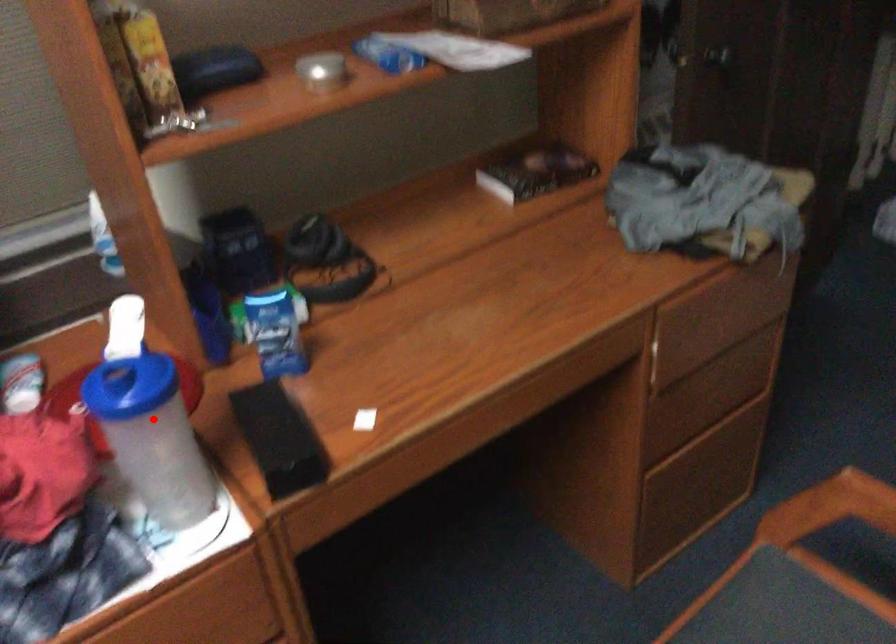
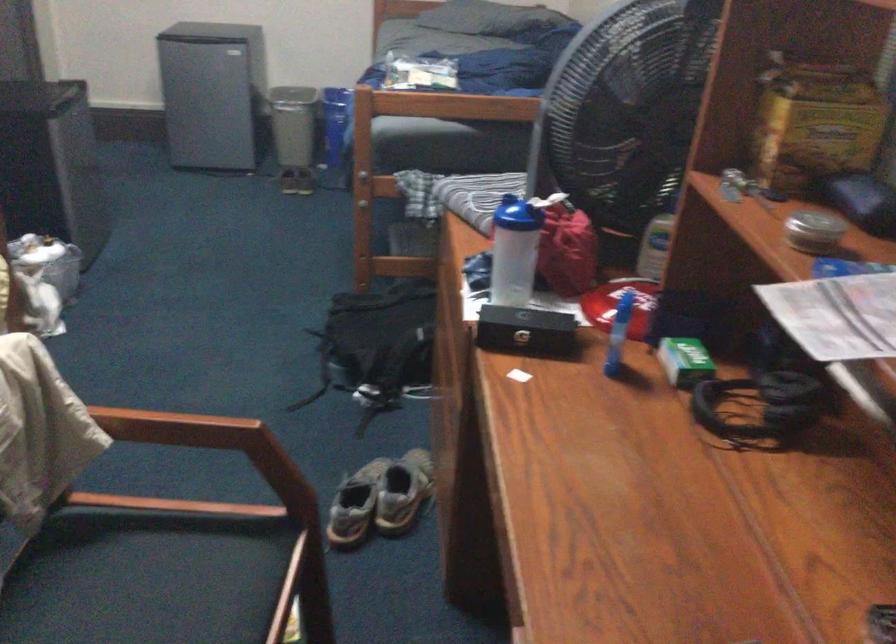
Question: I am providing you with two images of the same scene from different viewpoints. Image1 has a red point marked. In image2, the corresponding 3D location appears at what relative position? Reply with the corresponding letter.

Choices:
 (A) Closer
 (B) Farther

Answer: (B)